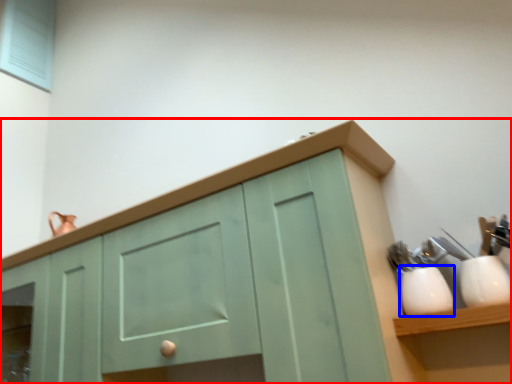
Question: Which of the following is the closest to the observer, cabinetry (highlighted by a red box) or tableware (highlighted by a blue box)?

Choices:
 (A) cabinetry
 (B) tableware

Answer: (A)